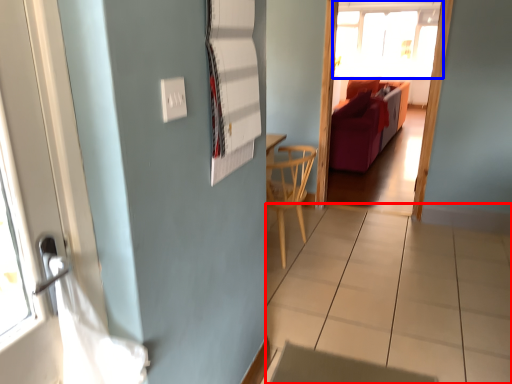
Question: Which of the following is the closest to the observer, tile (highlighted by a red box) or window (highlighted by a blue box)?

Choices:
 (A) tile
 (B) window

Answer: (A)